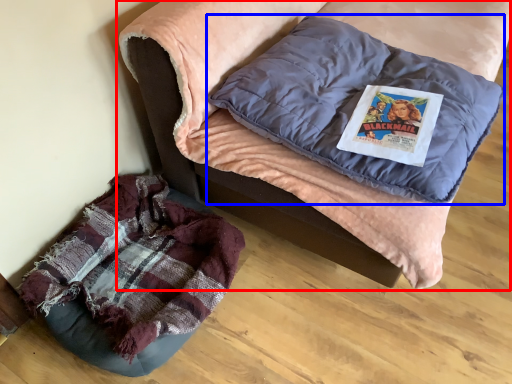
Question: Which object appears closest to the camera in this image, furniture (highlighted by a red box) or pillow (highlighted by a blue box)?

Choices:
 (A) furniture
 (B) pillow

Answer: (A)